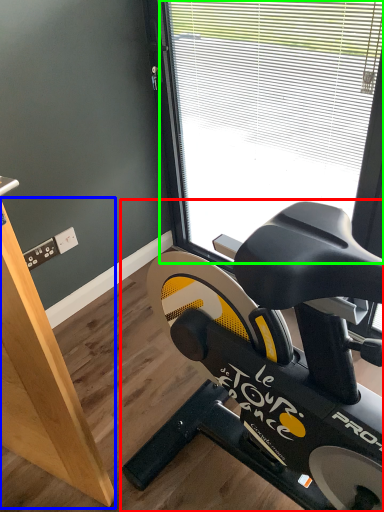
Question: Considering the real-world distances, which object is closest to stationary bicycle (highlighted by a red box)? plywood (highlighted by a blue box) or window (highlighted by a green box).

Choices:
 (A) plywood
 (B) window

Answer: (A)